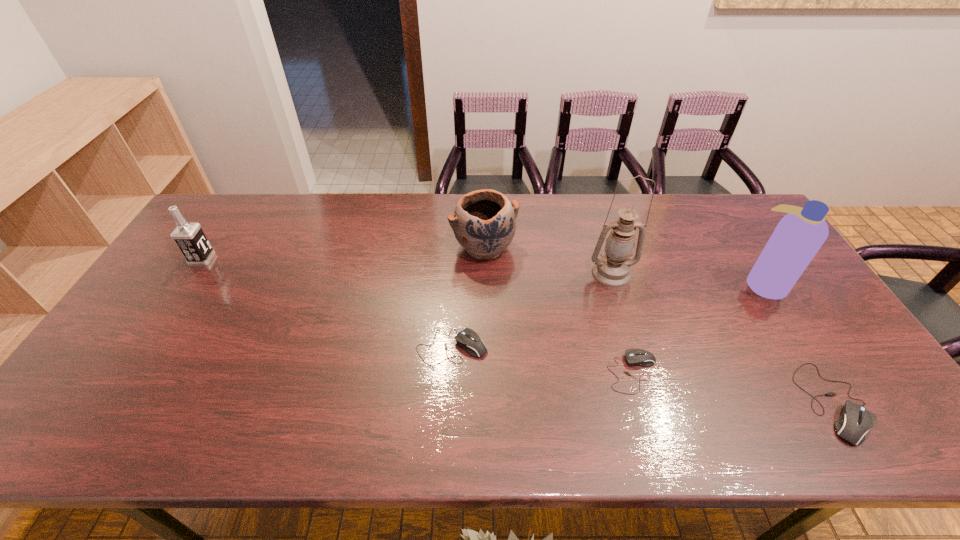
This screenshot has width=960, height=540. Find the location of `blank space located 0.340m on the back of the shortest object`. blank space located 0.340m on the back of the shortest object is located at coordinates pyautogui.click(x=602, y=262).

Where is `free location located on the back of the rightmost computer mouse`? free location located on the back of the rightmost computer mouse is located at coordinates (790, 332).

The image size is (960, 540). I want to click on vacant space located on the back of the pottery, so click(484, 215).

Locate an element on the screen. blank area located on the front of the oil lamp is located at coordinates (619, 300).

What are the coordinates of `vacant space located 0.180m on the front label of the vodka` in the screenshot? It's located at (270, 259).

This screenshot has height=540, width=960. Find the location of `vacant space located on the left of the shampoo`. vacant space located on the left of the shampoo is located at coordinates (683, 284).

Find the location of a particular element. object that is at the far edge is located at coordinates (483, 223).

Find the location of a particular element. object that is at the left edge is located at coordinates (189, 237).

In order to click on computer mouse that is at the right edge in this screenshot , I will do `click(855, 420)`.

Locate an element on the screen. Image resolution: width=960 pixels, height=540 pixels. shampoo located in the right edge section of the desktop is located at coordinates (799, 235).